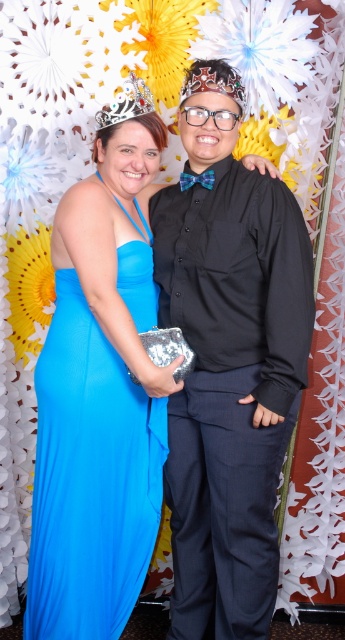
You are a photographer standing 2 meters away from the silver metallic crown at upper center. Can you reach it without moving your position?

The silver metallic crown at upper center is 1.52 meters from viewer, so you can reach it since you are only 2 meters away.

You are a photographer adjusting the lighting in the studio. You notice the matte black shirt at center and the silver metallic crown at upper center. Which object should you focus your light on first to ensure both are well lit, considering their positions?

The silver metallic crown at upper center should be focused on first since it is located above the matte black shirt at center, ensuring proper lighting from top to bottom.

In the scene shown: You are a photographer setting up for a group photo. You have to ensure that the matte black shirt at center and the silver metallic crown at upper center are both clearly visible in the frame. Given their positions, which object should you focus on first to ensure both are in focus?

The matte black shirt at center is much taller than the silver metallic crown at upper center, so focusing on the matte black shirt at center first would ensure both are in focus since it is the larger object in the frame.